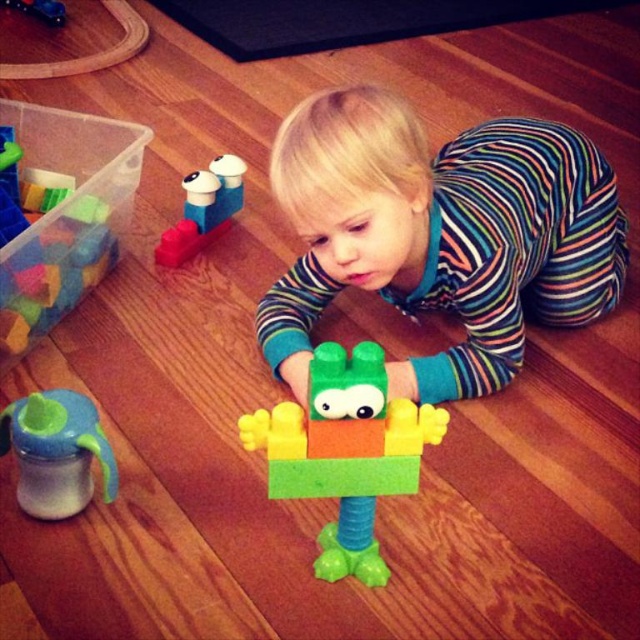
Is multicolored striped pajamas at center taller than matte plastic train at upper left?

Indeed, multicolored striped pajamas at center has a greater height compared to matte plastic train at upper left.

Who is positioned more to the left, multicolored striped pajamas at center or matte plastic train at upper left?

Positioned to the left is matte plastic train at upper left.

At what (x,y) coordinates should I click in order to perform the action: click on multicolored striped pajamas at center. Please return your answer as a coordinate pair (x, y). Looking at the image, I should click on (440, 234).

Where is `multicolored striped pajamas at center`? Image resolution: width=640 pixels, height=640 pixels. multicolored striped pajamas at center is located at coordinates (440, 234).

Who is shorter, multicolored striped pajamas at center or translucent plastic cup at upper left?

translucent plastic cup at upper left

Does point (262, 337) lie behind point (65, 10)?

No.

Find the location of `multicolored striped pajamas at center`. multicolored striped pajamas at center is located at coordinates (440, 234).

Can you confirm if matte plastic train at upper left is positioned to the right of translucent plastic cup at upper left?

Yes, matte plastic train at upper left is to the right of translucent plastic cup at upper left.

Does point (164, 260) lie in front of point (52, 6)?

That is True.

Which is behind, point (209, 168) or point (10, 0)?

Point (10, 0)

You are a GUI agent. You are given a task and a screenshot of the screen. Output one action in this format:
    pyautogui.click(x=<x>, y=<y>)
    Task: Click on the matte plastic train at upper left
    
    Given the screenshot: What is the action you would take?
    pyautogui.click(x=204, y=209)